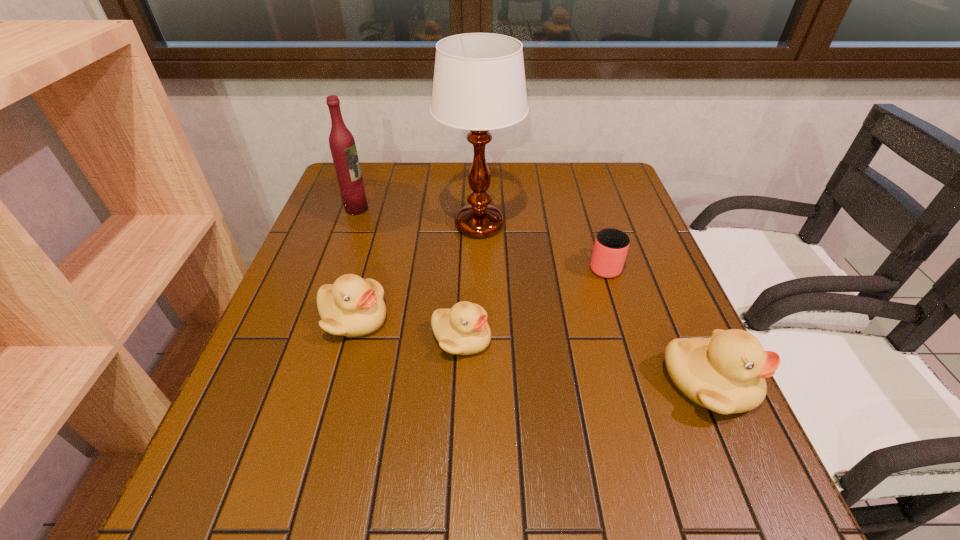
Locate an element on the screen. The width and height of the screenshot is (960, 540). free spot that satisfies the following two spatial constraints: 1. on the label of the table lamp; 2. on the left side of the second tallest object is located at coordinates (351, 225).

Find the location of `vacant point that satisfies the following two spatial constraints: 1. on the handle side of the second object from right to left; 2. on the label of the liquor`. vacant point that satisfies the following two spatial constraints: 1. on the handle side of the second object from right to left; 2. on the label of the liquor is located at coordinates (587, 209).